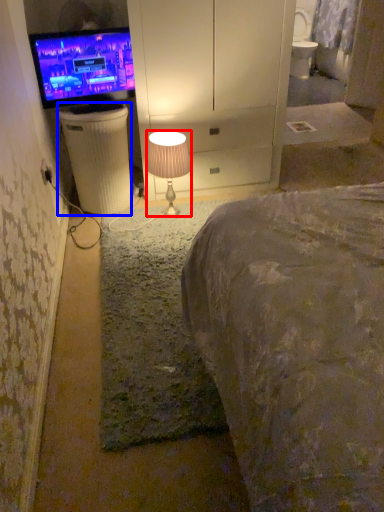
Question: Among these objects, which one is nearest to the camera, lamp (highlighted by a red box) or trash bin/can (highlighted by a blue box)?

Choices:
 (A) lamp
 (B) trash bin/can

Answer: (A)